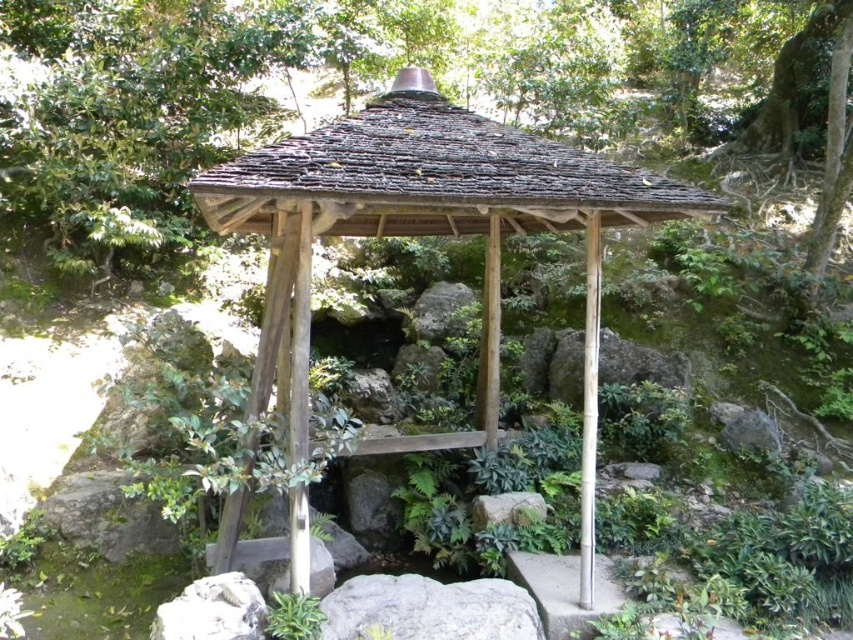
Question: Among these points, which one is nearest to the camera?

Choices:
 (A) (368, 220)
 (B) (622, 150)

Answer: (A)

Question: Observing the image, what is the correct spatial positioning of green leafy tree at center in reference to wooden gazebo at center?

Choices:
 (A) above
 (B) below

Answer: (A)

Question: Is green leafy tree at center thinner than wooden gazebo at center?

Choices:
 (A) no
 (B) yes

Answer: (A)

Question: Is green leafy tree at center to the right of wooden gazebo at center from the viewer's perspective?

Choices:
 (A) yes
 (B) no

Answer: (A)

Question: Which point appears closest to the camera in this image?

Choices:
 (A) (103, 214)
 (B) (605, 220)

Answer: (B)